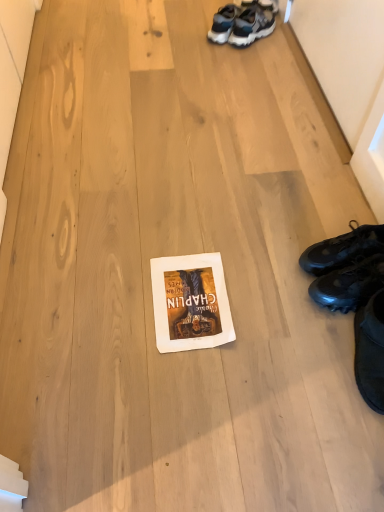
Question: From a real-world perspective, is white paper at center beneath black matte sneakers at lower right, arranged as the 2th footwear when viewed from the top?

Choices:
 (A) yes
 (B) no

Answer: (A)

Question: Is white paper at center thinner than black matte sneakers at lower right, acting as the first footwear starting from the bottom?

Choices:
 (A) no
 (B) yes

Answer: (A)

Question: Does white paper at center have a larger size compared to black matte sneakers at lower right, acting as the first footwear starting from the bottom?

Choices:
 (A) no
 (B) yes

Answer: (A)

Question: Is white paper at center to the left of black matte sneakers at lower right, arranged as the 2th footwear when viewed from the top, from the viewer's perspective?

Choices:
 (A) yes
 (B) no

Answer: (A)

Question: From a real-world perspective, is white paper at center on top of black matte sneakers at lower right, arranged as the 2th footwear when viewed from the top?

Choices:
 (A) no
 (B) yes

Answer: (A)

Question: From the image's perspective, relative to black leather shoes at right, the second footwear when ordered from bottom to top, is white paper at center above or below?

Choices:
 (A) below
 (B) above

Answer: (A)

Question: Considering the positions of white paper at center and black leather shoes at right, the second footwear when ordered from bottom to top, in the image, is white paper at center taller or shorter than black leather shoes at right, the second footwear when ordered from bottom to top,?

Choices:
 (A) short
 (B) tall

Answer: (A)

Question: Looking at their shapes, would you say white paper at center is wider or thinner than black leather shoes at right, which is counted as the first footwear, starting from the top?

Choices:
 (A) wide
 (B) thin

Answer: (A)

Question: Relative to black leather shoes at right, the second footwear when ordered from bottom to top, is white paper at center in front or behind?

Choices:
 (A) front
 (B) behind

Answer: (A)

Question: Considering their positions, is black matte sneakers at lower right, arranged as the 2th footwear when viewed from the top, located in front of or behind white paper at center?

Choices:
 (A) behind
 (B) front

Answer: (B)

Question: In terms of height, does black matte sneakers at lower right, acting as the first footwear starting from the bottom, look taller or shorter compared to white paper at center?

Choices:
 (A) short
 (B) tall

Answer: (B)

Question: Looking at their shapes, would you say black matte sneakers at lower right, arranged as the 2th footwear when viewed from the top, is wider or thinner than white paper at center?

Choices:
 (A) wide
 (B) thin

Answer: (B)

Question: Would you say black matte sneakers at lower right, acting as the first footwear starting from the bottom, is inside or outside white paper at center?

Choices:
 (A) outside
 (B) inside

Answer: (A)

Question: From a real-world perspective, relative to white paper at center, is black leather shoes at right, the second footwear when ordered from bottom to top, vertically above or below?

Choices:
 (A) below
 (B) above

Answer: (B)

Question: From the image's perspective, is black leather shoes at right, which is counted as the first footwear, starting from the top, above or below white paper at center?

Choices:
 (A) above
 (B) below

Answer: (A)